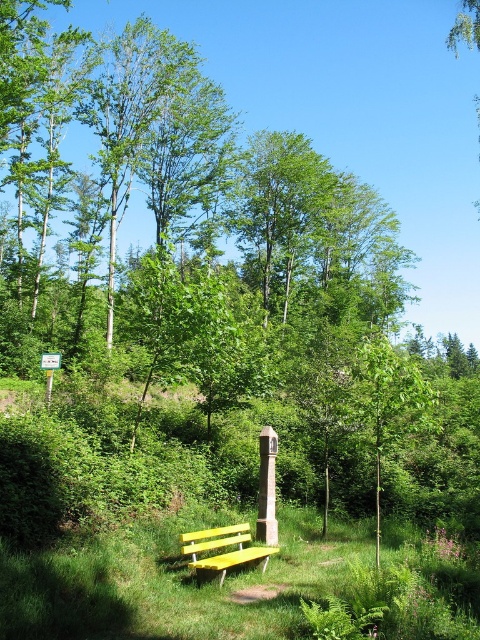
Question: Can you confirm if green grass at lower center is bigger than yellow painted wood bench at lower center?

Choices:
 (A) no
 (B) yes

Answer: (A)

Question: Which point is farther to the camera?

Choices:
 (A) (203, 538)
 (B) (164, 628)

Answer: (A)

Question: Which point is closer to the camera?

Choices:
 (A) tap(191, 596)
 (B) tap(223, 538)

Answer: (A)

Question: Is the position of green grass at lower center more distant than that of yellow painted wood bench at lower center?

Choices:
 (A) no
 (B) yes

Answer: (A)

Question: Does green grass at lower center lie behind yellow painted wood bench at lower center?

Choices:
 (A) no
 (B) yes

Answer: (A)